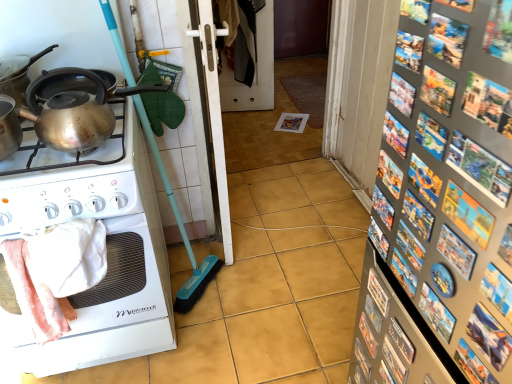
Question: Is shiny metallic kettle at upper left to the left or to the right of white glossy stove at left in the image?

Choices:
 (A) left
 (B) right

Answer: (A)

Question: Which is correct: shiny metallic kettle at upper left is inside white glossy stove at left, or outside of it?

Choices:
 (A) inside
 (B) outside

Answer: (B)

Question: Which of these objects is positioned farthest from the shiny metallic kettle at upper left?

Choices:
 (A) white plastic screen door at center, placed as the 1th screen door when sorted from front to back
 (B) white plastic screen door at center, positioned as the 1th screen door in back-to-front order
 (C) shiny metallic kettle at left
 (D) shiny metallic kettle at upper left
 (E) metallic silver magnets at right

Answer: (B)

Question: Based on their relative distances, which object is farther from the shiny metallic kettle at left?

Choices:
 (A) white plastic screen door at center, the 2th screen door positioned from the front
 (B) shiny metallic kettle at upper left
 (C) metallic silver magnets at right
 (D) white plastic screen door at center, placed as the 1th screen door when sorted from front to back
 (E) white glossy stove at left

Answer: (A)